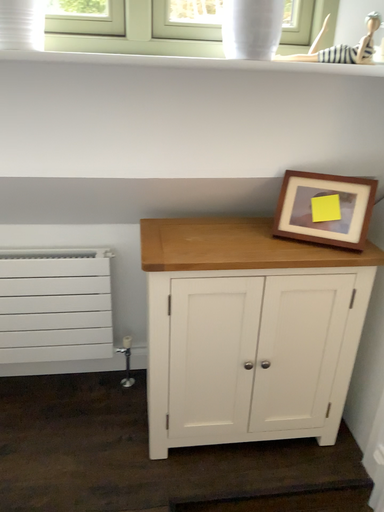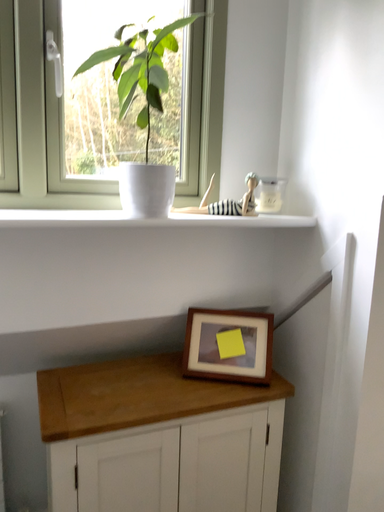
Question: Which way did the camera rotate in the video?

Choices:
 (A) rotated right
 (B) rotated left

Answer: (A)